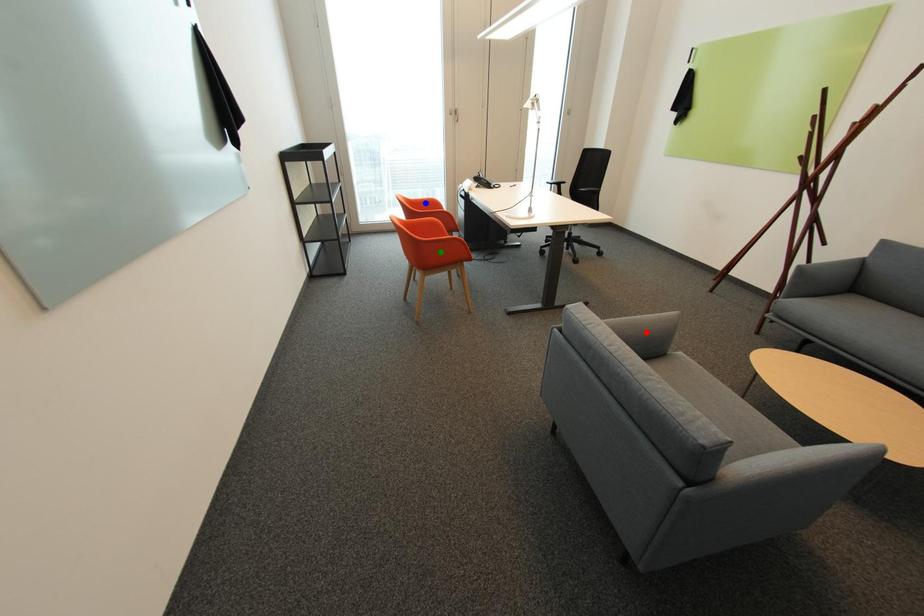
Order these from nearest to farthest:
green point | blue point | red point

red point, blue point, green point